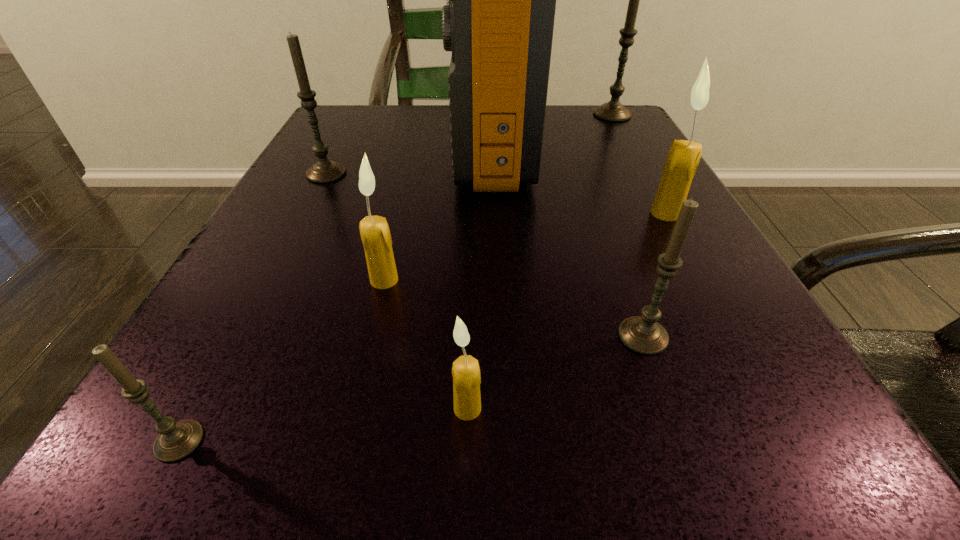
Find the location of `the tallest object`. the tallest object is located at coordinates (498, 22).

Locate an element on the screen. the biggest gray candle is located at coordinates 614,111.

You are a GUI agent. You are given a task and a screenshot of the screen. Output one action in this format:
    pyautogui.click(x=<x>, y=<y>)
    Task: Click on the tallest candle
    This screenshot has height=540, width=960.
    Given the screenshot: What is the action you would take?
    pyautogui.click(x=614, y=111)

The height and width of the screenshot is (540, 960). I want to click on the third nearest gray candle, so 324,171.

Where is `the sixth nearest candle`? the sixth nearest candle is located at coordinates (324, 171).

You are a GUI agent. You are given a task and a screenshot of the screen. Output one action in this format:
    pyautogui.click(x=<x>, y=<y>)
    Task: Click on the farthest cream candle
    The height and width of the screenshot is (540, 960).
    Given the screenshot: What is the action you would take?
    683,158

Locate an element on the screen. This screenshot has width=960, height=540. the third farthest candle is located at coordinates [683, 158].

I want to click on the third object from left to right, so click(374, 230).

At what (x,y) coordinates should I click in order to perform the action: click on the leftmost cream candle. Please return your answer as a coordinate pair (x, y). Looking at the image, I should click on (374, 230).

Locate an element on the screen. the third object from right to left is located at coordinates (643, 334).